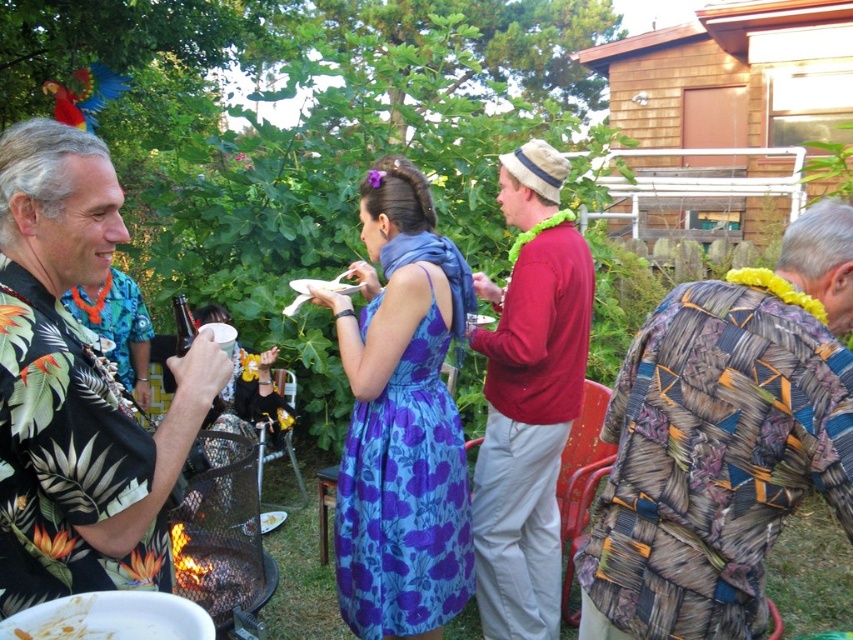
Question: Which point appears closest to the camera in this image?

Choices:
 (A) (419, 598)
 (B) (55, 468)
 (C) (550, 600)
 (D) (666, 556)

Answer: (B)

Question: Which of these objects is positioned closest to the matte purple dress at center?

Choices:
 (A) red cotton shirt at center
 (B) floral print shirt at left
 (C) patchwork fabric shirt at right

Answer: (A)

Question: From the image, what is the correct spatial relationship of patchwork fabric shirt at right in relation to red cotton shirt at center?

Choices:
 (A) left
 (B) right

Answer: (B)

Question: Is patchwork fabric shirt at right below matte purple dress at center?

Choices:
 (A) yes
 (B) no

Answer: (A)

Question: Is patchwork fabric shirt at right smaller than red cotton shirt at center?

Choices:
 (A) no
 (B) yes

Answer: (B)

Question: Which object is farther from the camera taking this photo?

Choices:
 (A) matte purple dress at center
 (B) red cotton shirt at center

Answer: (B)